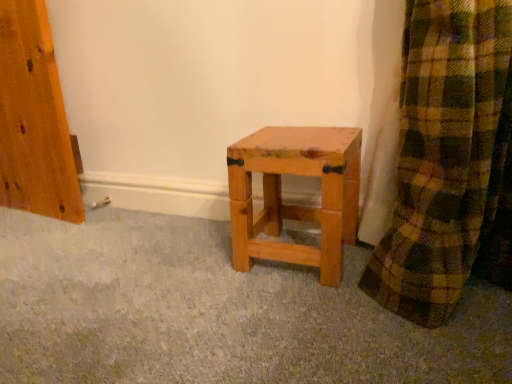
Identify the location of free space on the front side of natural wood stool at center. Image resolution: width=512 pixels, height=384 pixels. (303, 303).